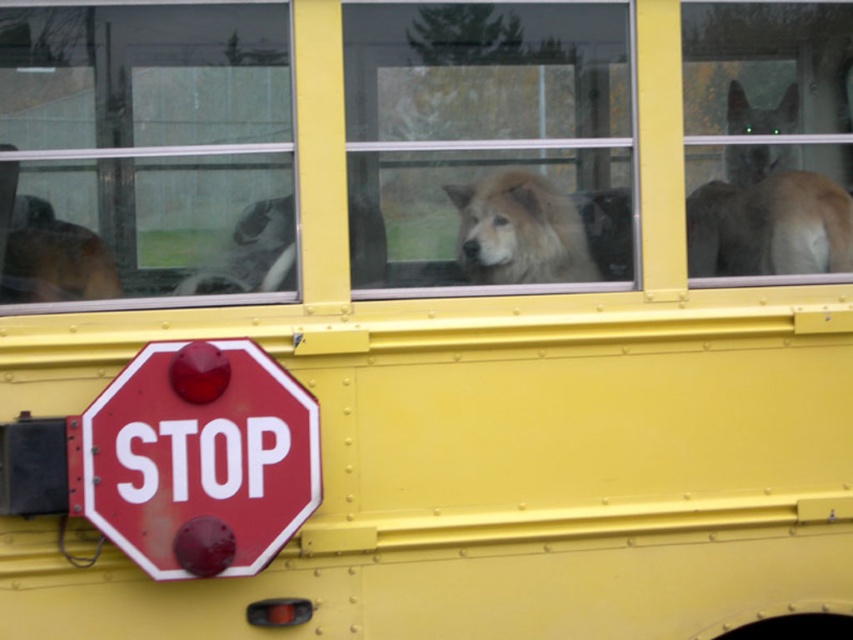
Is the position of translucent glass dog at upper right less distant than that of fluffy white dog at center?

No, translucent glass dog at upper right is behind fluffy white dog at center.

Which of these two, translucent glass dog at upper right or fluffy white dog at center, stands shorter?

With less height is fluffy white dog at center.

Is point (808, 225) behind point (550, 202)?

Yes, point (808, 225) is behind point (550, 202).

Find the location of a particular element. The image size is (853, 640). translucent glass dog at upper right is located at coordinates (769, 138).

Can you confirm if transparent glass window at upper left is taller than smooth red stop sign at lower left?

Indeed, transparent glass window at upper left has a greater height compared to smooth red stop sign at lower left.

Measure the distance between point (289,100) and camera.

A distance of 8.46 feet exists between point (289,100) and camera.

Is point (264, 163) closer to camera compared to point (109, 387)?

No.

Image resolution: width=853 pixels, height=640 pixels. Find the location of `transparent glass window at upper left`. transparent glass window at upper left is located at coordinates (144, 150).

What do you see at coordinates (488, 141) in the screenshot? The width and height of the screenshot is (853, 640). I see `translucent glass dog at center` at bounding box center [488, 141].

Is point (373, 17) closer to viewer compared to point (86, 429)?

That is False.

Describe the element at coordinates (488, 141) in the screenshot. I see `translucent glass dog at center` at that location.

This screenshot has width=853, height=640. I want to click on translucent glass dog at center, so click(488, 141).